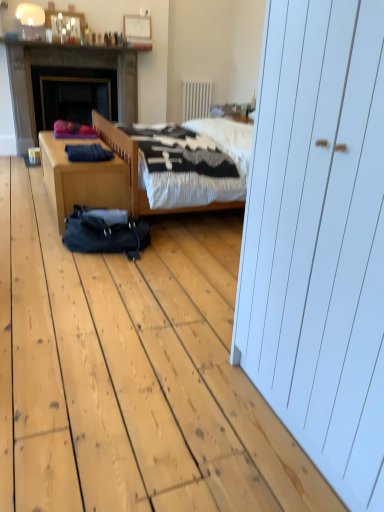
Question: From a real-world perspective, is white textured radiator at upper center positioned above or below dark gray stone fireplace at left?

Choices:
 (A) above
 (B) below

Answer: (A)

Question: From the image's perspective, is white textured radiator at upper center above or below dark gray stone fireplace at left?

Choices:
 (A) below
 (B) above

Answer: (B)

Question: Estimate the real-world distances between objects in this image. Which object is farther from the shiny glass bottles at upper center?

Choices:
 (A) black fabric sleeping bag at center
 (B) wooden desk at lower left
 (C) matte white lampshade at upper left
 (D) white textured radiator at upper center
 (E) dark gray stone fireplace at left

Answer: (A)

Question: Estimate the real-world distances between objects in this image. Which object is farther from the matte white lampshade at upper left?

Choices:
 (A) white textured radiator at upper center
 (B) black fabric sleeping bag at center
 (C) wooden desk at lower left
 (D) shiny glass bottles at upper center
 (E) dark gray stone fireplace at left

Answer: (B)